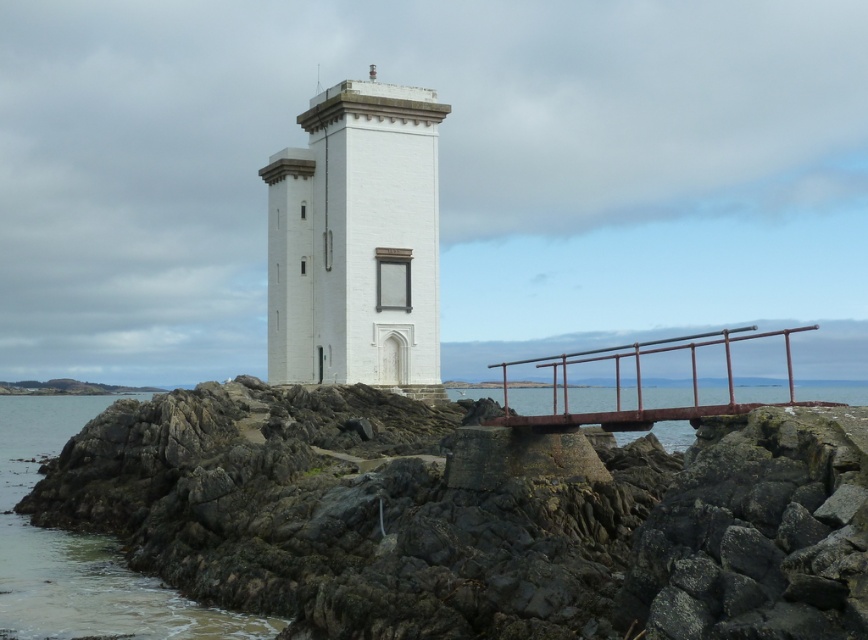
Is point (376, 99) closer to camera compared to point (616, 419)?

No, (376, 99) is further to viewer.

Does point (281, 216) come in front of point (708, 403)?

That is True.

The height and width of the screenshot is (640, 868). What are the coordinates of `white matte tower at center` in the screenshot? It's located at (356, 241).

Who is more distant from viewer, [162,612] or [748,330]?

The point [748,330] is behind.

Is clear water at lower left to the right of rusty metal railing at center from the viewer's perspective?

No, clear water at lower left is not to the right of rusty metal railing at center.

Find the location of `clear water at lower left`. clear water at lower left is located at coordinates (83, 550).

Which is in front, point (314, 515) or point (687, 406)?

Positioned in front is point (314, 515).

Does rough stone rocks at center appear on the left side of rusty metal railing at center?

Correct, you'll find rough stone rocks at center to the left of rusty metal railing at center.

Does point (469, 595) lie in front of point (718, 337)?

Yes, it is.

You are a GUI agent. You are given a task and a screenshot of the screen. Output one action in this format:
    pyautogui.click(x=<x>, y=<y>)
    Task: Click on the rough stone rocks at center
    The width and height of the screenshot is (868, 640).
    Given the screenshot: What is the action you would take?
    pyautogui.click(x=320, y=524)